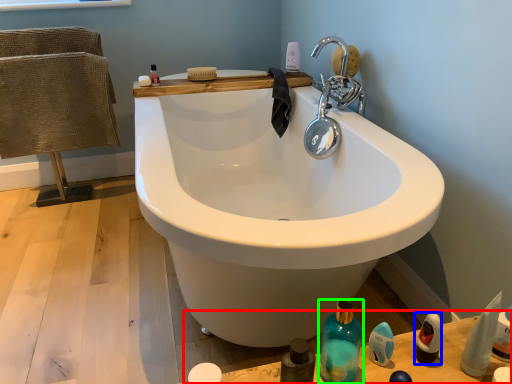
Question: Estimate the real-world distances between objects in this image. Which object is farther from counter top (highlighted by a red box), mouthwash (highlighted by a blue box) or bottle (highlighted by a green box)?

Choices:
 (A) mouthwash
 (B) bottle

Answer: (A)